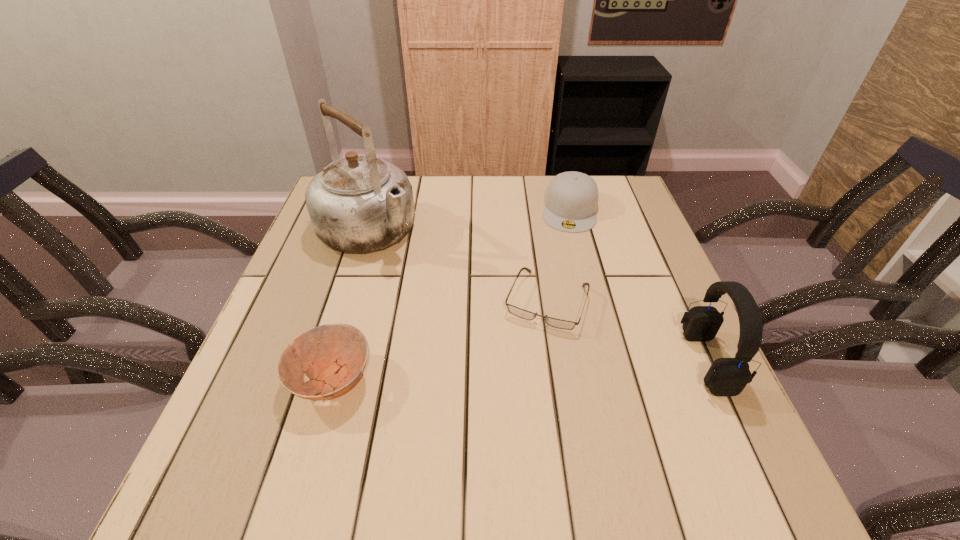
Find the location of a particular element. The width and height of the screenshot is (960, 540). bowl is located at coordinates (338, 352).

This screenshot has height=540, width=960. In order to click on headset in this screenshot , I will do pyautogui.click(x=726, y=376).

I want to click on the rightmost object, so click(726, 376).

Identify the location of cap. This screenshot has height=540, width=960. (571, 201).

This screenshot has height=540, width=960. What are the coordinates of `kettle` in the screenshot? It's located at (360, 203).

The width and height of the screenshot is (960, 540). I want to click on spectacles, so click(524, 314).

I want to click on free spot located 0.060m on the left of the fourth tallest object, so click(260, 379).

At what (x,y) coordinates should I click in order to perform the action: click on vacant space located on the front-facing side of the cap. Please return your answer as a coordinate pair (x, y). Looking at the image, I should click on (558, 339).

You are a GUI agent. You are given a task and a screenshot of the screen. Output one action in this format:
    pyautogui.click(x=<x>, y=<y>)
    Task: Click on the vacant space positioned 0.200m on the front-facing side of the cap
    Image resolution: width=960 pixels, height=540 pixels.
    Given the screenshot: What is the action you would take?
    pyautogui.click(x=564, y=281)

The image size is (960, 540). Identify the location of vacant space located on the front-facing side of the cap. (560, 325).